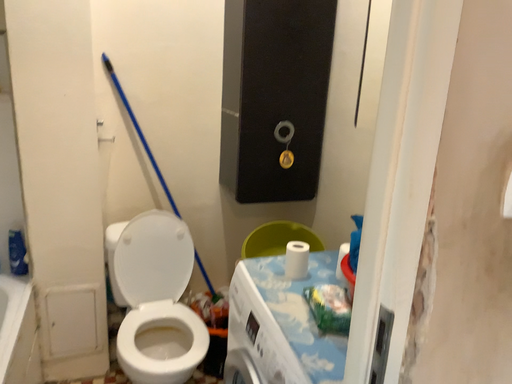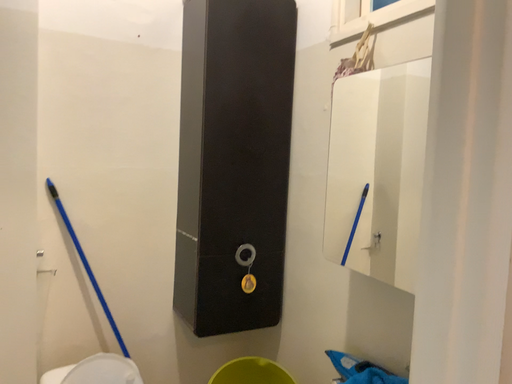
Question: How did the camera likely rotate when shooting the video?

Choices:
 (A) rotated left
 (B) rotated right

Answer: (B)